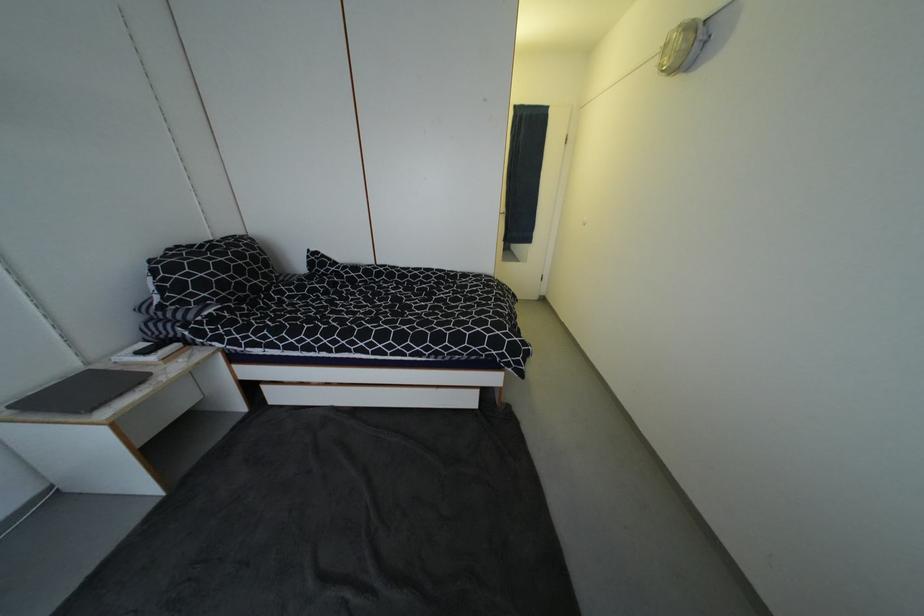
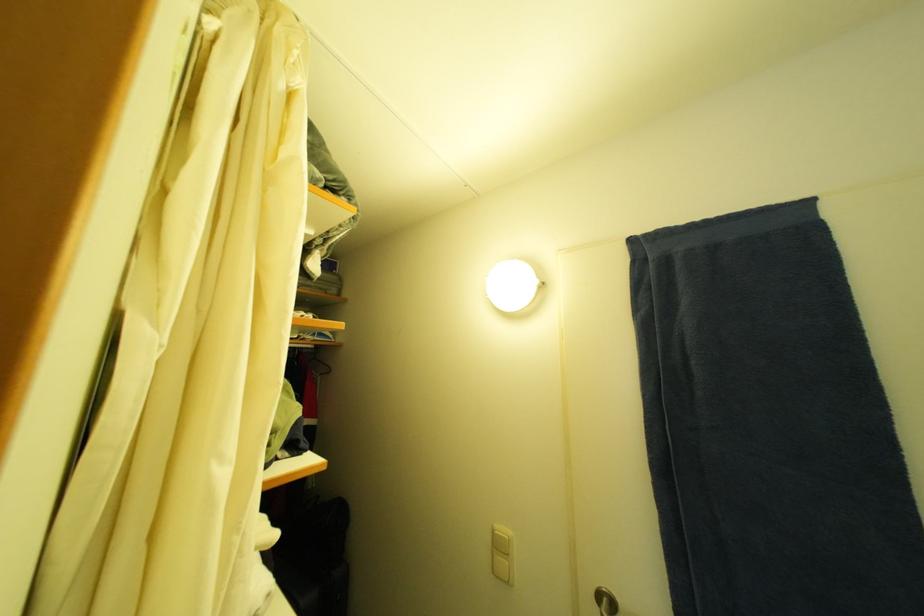
Locate, in the second image, the point that corresponds to point (553, 108) in the first image.

(813, 205)